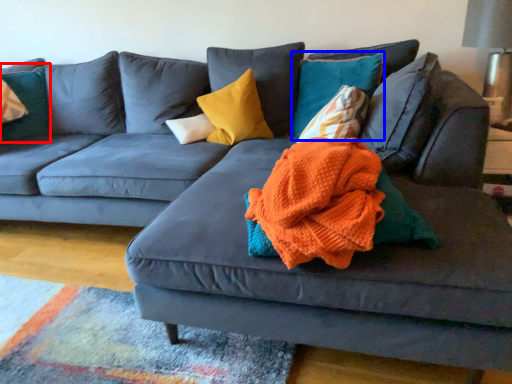
Question: Which of the following is the closest to the observer, pillow (highlighted by a red box) or pillow (highlighted by a blue box)?

Choices:
 (A) pillow
 (B) pillow

Answer: (B)